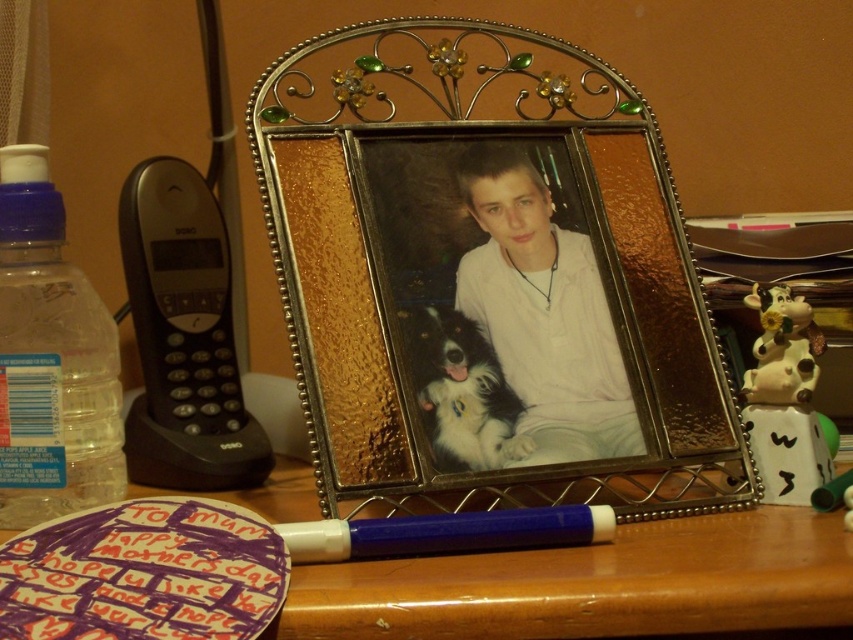
Can you confirm if white matte shirt at center is shorter than translucent plastic bottle at left?

Correct, white matte shirt at center is not as tall as translucent plastic bottle at left.

Who is positioned more to the right, white matte shirt at center or translucent plastic bottle at left?

white matte shirt at center is more to the right.

Find the location of a particular element. Image resolution: width=853 pixels, height=640 pixels. white matte shirt at center is located at coordinates (543, 312).

Is metallic gold picture frame at center smaller than fluffy white dog at center?

No.

Can you confirm if metallic gold picture frame at center is positioned above fluffy white dog at center?

Yes, metallic gold picture frame at center is above fluffy white dog at center.

Image resolution: width=853 pixels, height=640 pixels. Identify the location of metallic gold picture frame at center. (489, 269).

Who is positioned more to the right, white matte shirt at center or white plastic pen at center?

white matte shirt at center is more to the right.

I want to click on white matte shirt at center, so click(x=543, y=312).